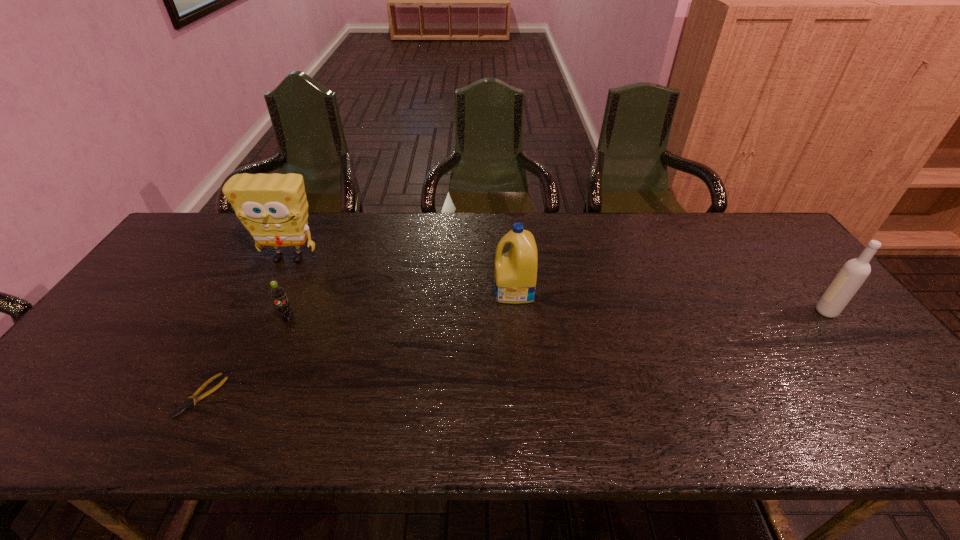
This screenshot has width=960, height=540. I want to click on vacant space that's between the second object from right to left and the soda, so click(401, 305).

Where is `unoccupied position between the detergent and the soda`? unoccupied position between the detergent and the soda is located at coordinates (401, 305).

The image size is (960, 540). Identify the location of object that stands as the fourth closest to the fourth tallest object. (854, 272).

Where is `the closest object to the farthest object`? This screenshot has height=540, width=960. the closest object to the farthest object is located at coordinates tap(277, 293).

You are a GUI agent. You are given a task and a screenshot of the screen. Output one action in this format:
    pyautogui.click(x=<x>, y=<y>)
    Task: Click on the vacant region that satisfies the following two spatial constraints: 1. on the label of the vodka; 2. on the left side of the fourth object from left to right
    
    Given the screenshot: What is the action you would take?
    pyautogui.click(x=516, y=312)

The height and width of the screenshot is (540, 960). I want to click on free spot that satisfies the following two spatial constraints: 1. on the label of the fourth object from left to right; 2. on the right side of the rightmost object, so click(x=516, y=312).

This screenshot has height=540, width=960. In order to click on free region that satisfies the following two spatial constraints: 1. on the label of the detergent; 2. on the front side of the nearest object in this screenshot , I will do `click(522, 396)`.

The width and height of the screenshot is (960, 540). Identify the location of vacant space that satisfies the following two spatial constraints: 1. on the label of the detergent; 2. on the front label of the soda. (516, 319).